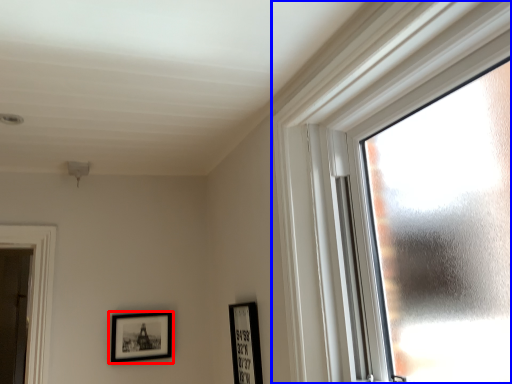
Question: Which object is closer to the camera taking this photo, picture frame (highlighted by a red box) or window (highlighted by a blue box)?

Choices:
 (A) picture frame
 (B) window

Answer: (B)